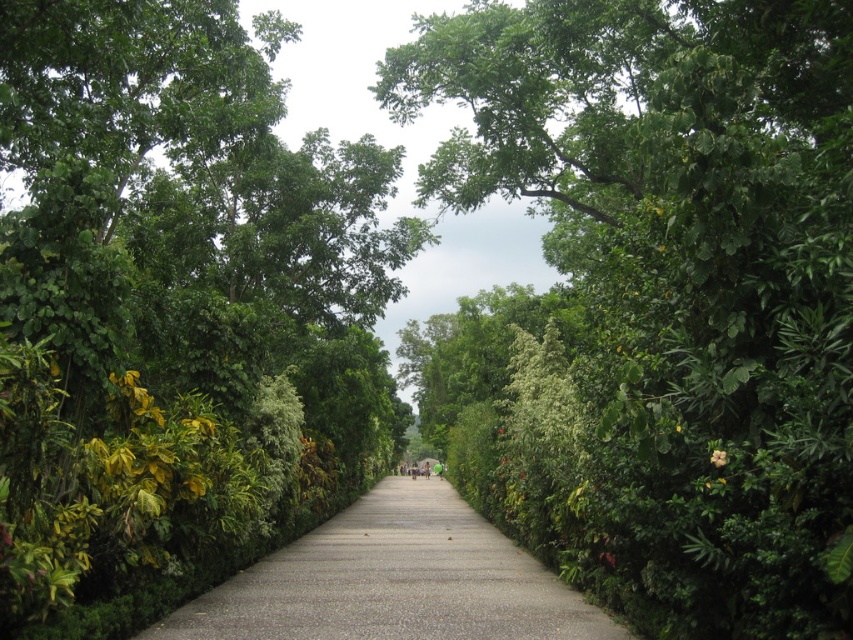
Who is taller, green leafy tree at center or gray concrete pavement at center?

green leafy tree at center is taller.

Between point (775, 417) and point (204, 608), which one is positioned in front?

Positioned in front is point (775, 417).

Is point (576, 365) positioned before point (421, 500)?

Yes, point (576, 365) is closer to viewer.

You are a GUI agent. You are given a task and a screenshot of the screen. Output one action in this format:
    pyautogui.click(x=<x>, y=<y>)
    Task: Click on the green leafy tree at center
    This screenshot has width=853, height=640.
    Given the screenshot: What is the action you would take?
    pyautogui.click(x=654, y=300)